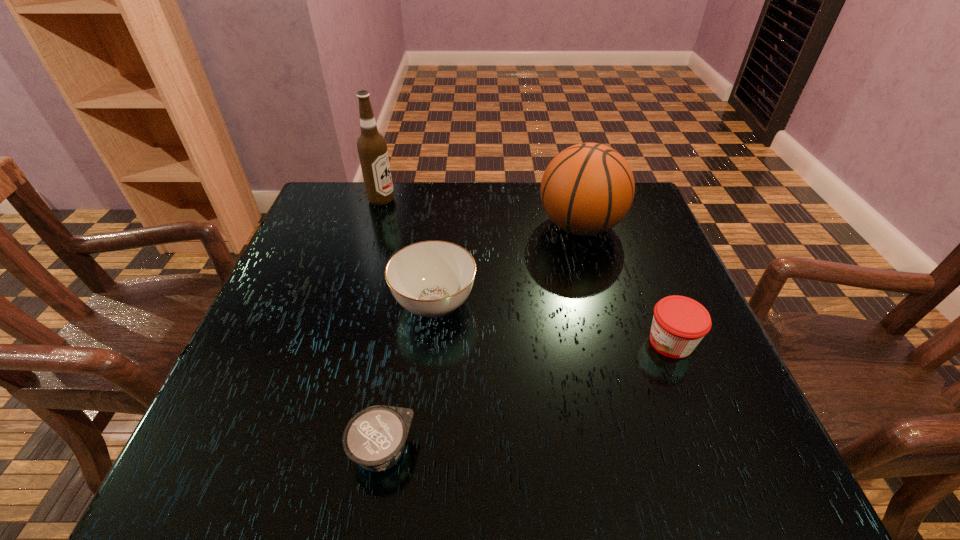
You are a GUI agent. You are given a task and a screenshot of the screen. Output one action in this format:
    pyautogui.click(x=<x>, y=<y>)
    Task: Click on the tallest object
    This screenshot has width=960, height=540.
    Given the screenshot: What is the action you would take?
    pyautogui.click(x=372, y=148)

The height and width of the screenshot is (540, 960). Find the location of `the leftmost object`. the leftmost object is located at coordinates (372, 148).

Where is `the fourth shortest object`? The height and width of the screenshot is (540, 960). the fourth shortest object is located at coordinates (587, 189).

At what (x,y) coordinates should I click in order to perform the action: click on chinaware. Please return your answer as a coordinate pair (x, y). This screenshot has width=960, height=540. Looking at the image, I should click on (431, 279).

Locate an element on the screen. The height and width of the screenshot is (540, 960). jam is located at coordinates (679, 323).

This screenshot has height=540, width=960. In order to click on yogurt in this screenshot , I will do point(374,438).

At what (x,y) coordinates should I click in order to perform the action: click on the shortest object. Please return your answer as a coordinate pair (x, y). Looking at the image, I should click on (374, 438).

Locate an element on the screen. The height and width of the screenshot is (540, 960). vacant region located on the label of the leftmost object is located at coordinates (490, 200).

At what (x,y) coordinates should I click in order to perform the action: click on vacant area located 0.220m on the left of the basketball. Please return your answer as a coordinate pair (x, y). Looking at the image, I should click on (451, 226).

Locate an element on the screen. This screenshot has height=540, width=960. free space located 0.100m on the front of the chinaware is located at coordinates (426, 380).